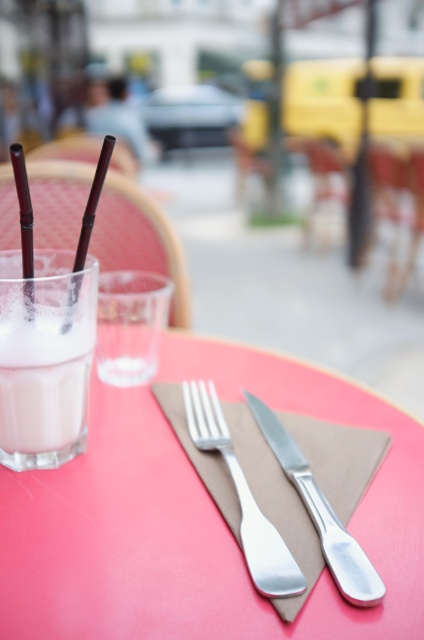
Question: Which point appears closest to the camera in this image?

Choices:
 (A) (250, 524)
 (B) (31, 244)

Answer: (A)

Question: Among these objects, which one is nearest to the camera?

Choices:
 (A) polished silver fork at center
 (B) white frothy milk at left
 (C) polished silver knife at center

Answer: (C)

Question: Can you confirm if polished silver knife at center is bigger than translucent plastic straw at upper left?

Choices:
 (A) no
 (B) yes

Answer: (B)

Question: Is metallic silver fork at upper center positioned in front of translucent plastic straw at upper left?

Choices:
 (A) no
 (B) yes

Answer: (B)

Question: Is white frothy milk at left below polished silver knife at center?

Choices:
 (A) yes
 (B) no

Answer: (B)

Question: Which object is farther from the camera taking this photo?

Choices:
 (A) white frothy milk at left
 (B) translucent plastic straw at upper left
 (C) metallic silver fork at upper center
 (D) black matte straw at upper left

Answer: (A)